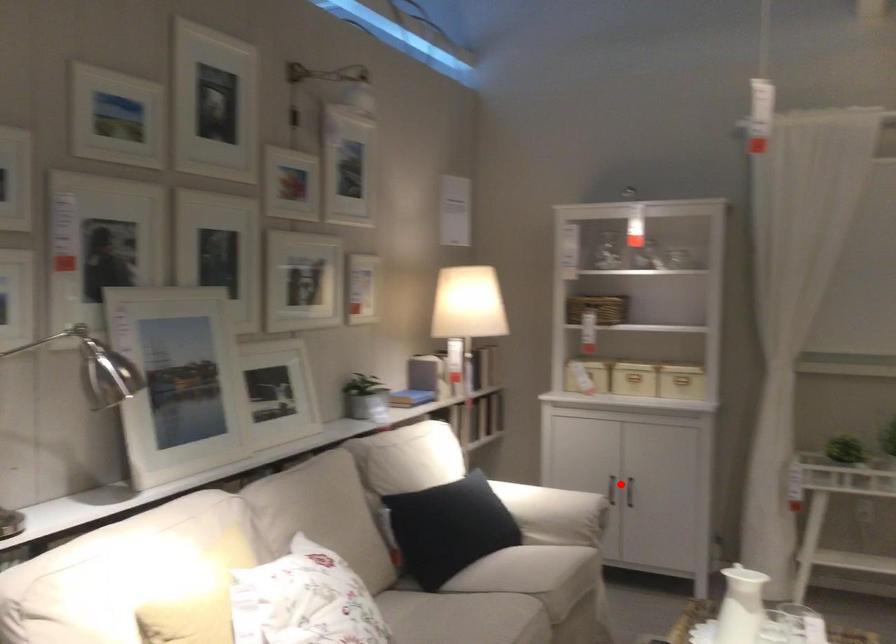
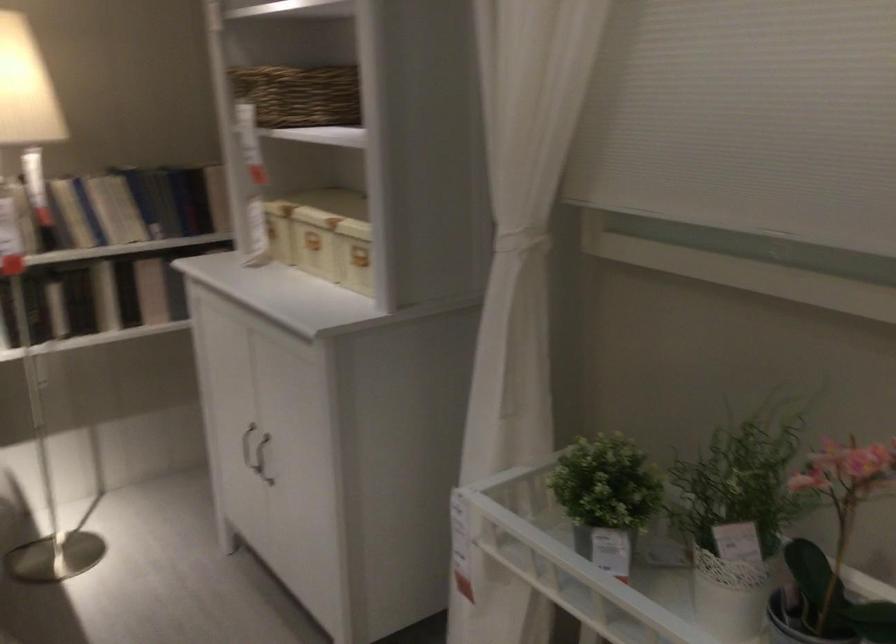
Where in the second image is the point corresponding to the highlighted location from the first image?

(247, 446)